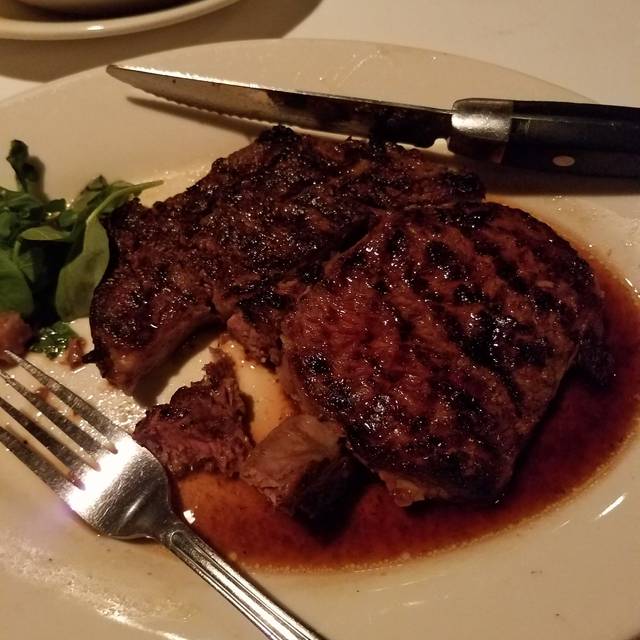
Where is `fork`? fork is located at coordinates (106, 488).